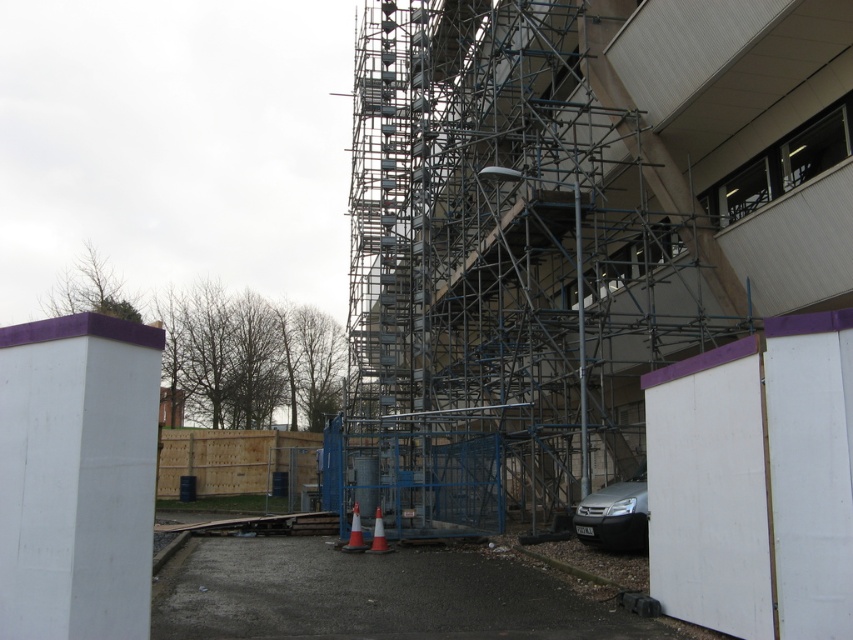
You are standing at the origin point of the coordinate system in the construction site image. The origin is at the bottom left corner of the image. You see a point labeled as point (354, 532). What object is located at that point?

The point (354, 532) corresponds to the orange reflective cone at lower center.

You are standing at the center of the construction site and see a point marked at coordinate [614,515]. Based on the scene description, what object is located at that point?

The point at coordinate [614,515] is located on the satin silver car at lower right.